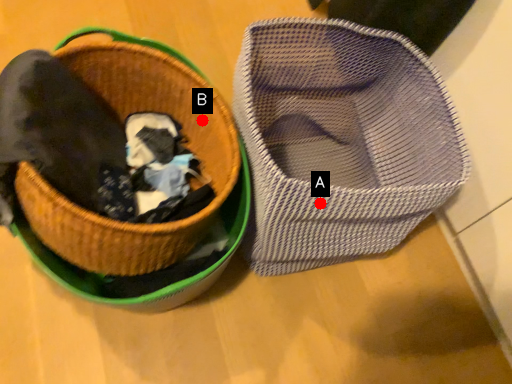
Question: Two points are circled on the image, labeled by A and B beside each circle. Which of the following is the farthest from the observer?

Choices:
 (A) A is further
 (B) B is further

Answer: (B)